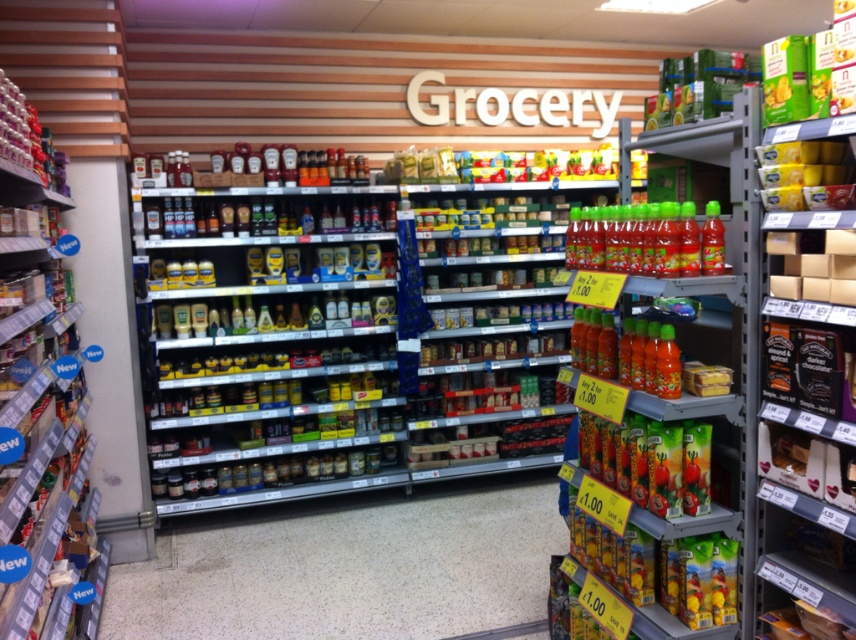
You are a grocery store employee who needs to restock the shelves. You have a metallic silver canisters at left and a yellow plastic container at upper right. Which container should you place on the lower shelf if you want to use the bigger one there?

The metallic silver canisters at left is bigger than the yellow plastic container at upper right, so you should place the metallic silver canisters at left on the lower shelf.

You are a customer looking for a specific metallic silver canister in the grocery store aisle. You see both the metallic silver canisters at center and the metallic silver canisters at left. Which one is positioned lower on the shelf?

The metallic silver canisters at center is located below the metallic silver canisters at left, so it is positioned lower on the shelf.

From the picture: You are a customer in a grocery store looking for the green plastic juice bottles at right. According to the store layout, where exactly are they located?

The green plastic juice bottles at right are located at point (721,321).